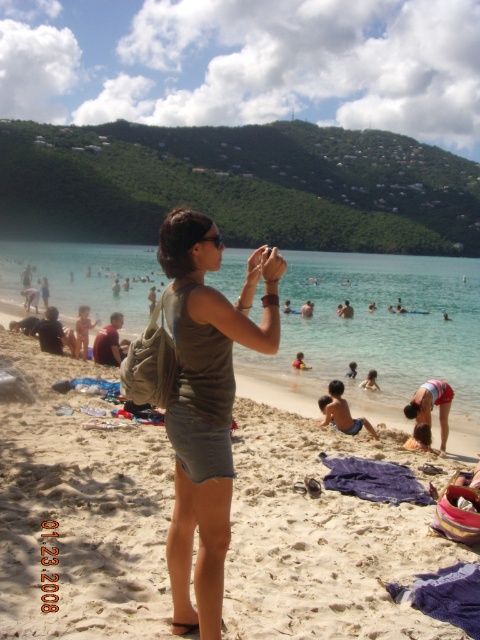
Locate an element on the screen. The height and width of the screenshot is (640, 480). beige sand at center is located at coordinates (80, 509).

Between point (34, 340) and point (303, 365), which one is positioned in front?

Point (34, 340) is in front.

What do you see at coordinates (80, 509) in the screenshot? I see `beige sand at center` at bounding box center [80, 509].

Find the location of a particular element. The height and width of the screenshot is (640, 480). beige sand at center is located at coordinates (80, 509).

Who is more forward, (342,296) or (375,381)?

Point (375,381) is more forward.

Between clear water at center and smooth sand at lower center, which one has more height?

clear water at center is taller.

You are a GUI agent. You are given a task and a screenshot of the screen. Output one action in this format:
    pyautogui.click(x=<x>, y=<y>)
    Task: Click on the clear water at center
    
    Given the screenshot: What is the action you would take?
    pyautogui.click(x=381, y=323)

The width and height of the screenshot is (480, 640). I want to click on clear water at center, so click(x=381, y=323).

Is clear water at center to the right of green fabric dress at center from the viewer's perspective?

In fact, clear water at center is to the left of green fabric dress at center.

Locate an element on the screen. clear water at center is located at coordinates (381, 323).

In the scene shown: Who is more distant from viewer, (422, 268) or (199, 435)?

The point (422, 268) is behind.

Image resolution: width=480 pixels, height=640 pixels. Find the location of `clear water at center`. clear water at center is located at coordinates (381, 323).